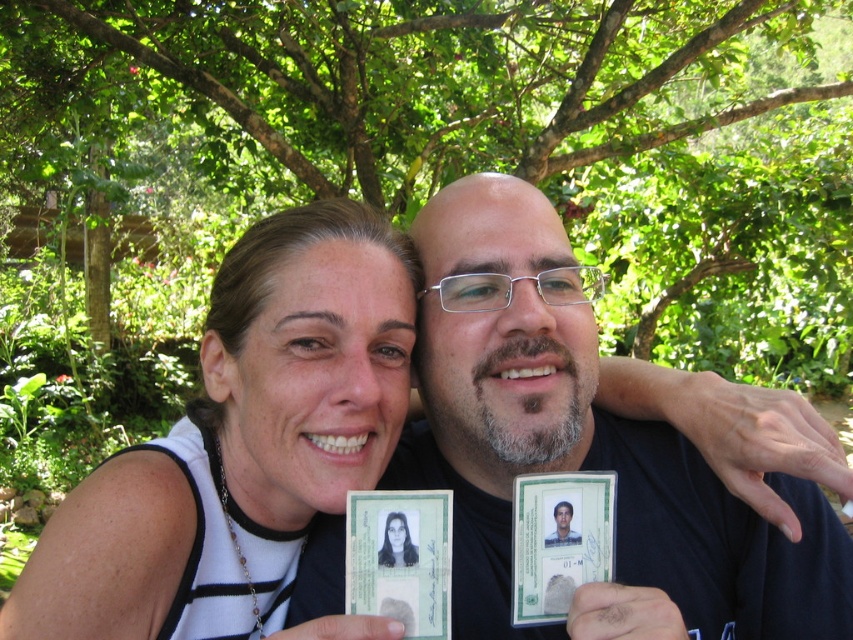
You are a photographer trying to capture a clear photo of the green plastic id card at center while keeping the green leafy tree at upper center in the background. Given that the camera can only focus on one object at a time, which object should you focus on to ensure the ID card is sharp and the tree remains recognizable in the background?

You should focus on the green plastic id card at center because it is smaller than the green leafy tree at upper center, allowing the tree to stay recognizable in the background while ensuring the ID card is sharp.

You are a photographer trying to capture a clear shot of the smooth black id card at center and the green leafy tree at upper center. Since the tree might block the ID card, will the ID card be visible in the photo if you focus on the tree?

The smooth black id card at center is behind the green leafy tree at upper center, so if you focus on the tree, the ID card might be obscured by the tree and not fully visible in the photo.

You are standing in a tropical garden and want to take a photo under the shade of the green leafy tree at upper center. The coordinates of the tree are given as point (508,134). If you are currently at the origin point 0,0, which direction should you move to reach the tree?

The green leafy tree at upper center is located at point (508,134), so you should move northeast to reach it.